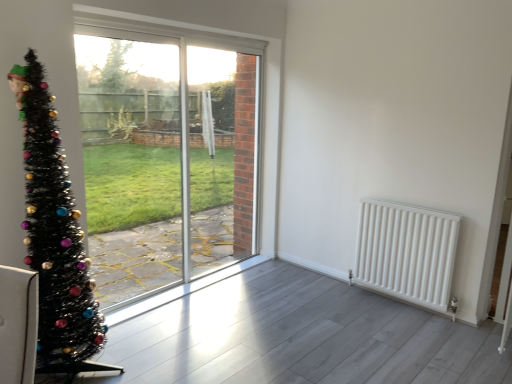
The image size is (512, 384). In order to click on vacant area on top of clear glass screen door at center (from a real-world perspective) in this screenshot , I will do `click(214, 40)`.